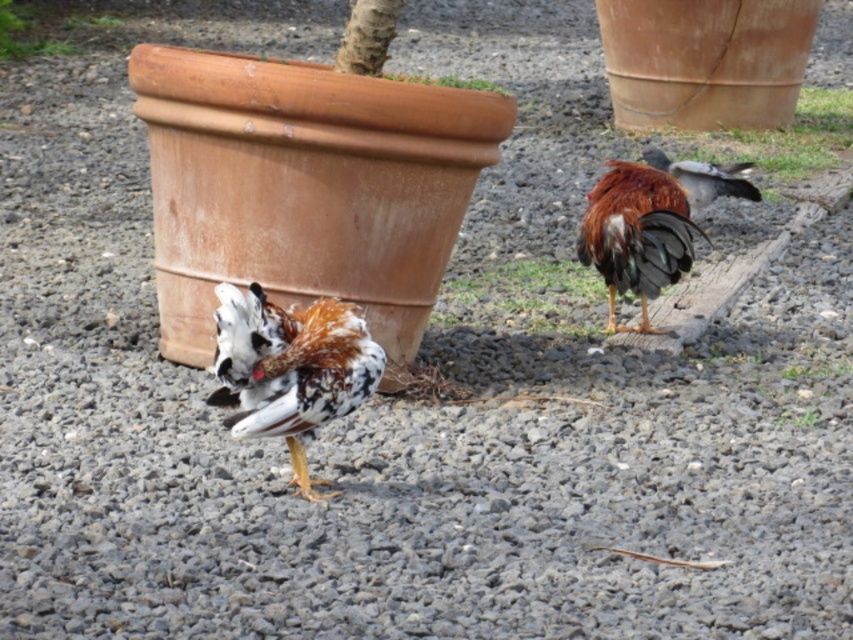
Question: Which of the following is the farthest from the observer?

Choices:
 (A) (630, 196)
 (B) (424, 76)

Answer: (B)

Question: Based on their relative distances, which object is farther from the green leafy plant at upper center?

Choices:
 (A) matte terracotta pot at upper left
 (B) matte brown pot at upper right

Answer: (A)

Question: Can you confirm if speckled feathered chicken at center is smaller than matte brown pot at upper right?

Choices:
 (A) yes
 (B) no

Answer: (A)

Question: Which of these objects is positioned farthest from the speckled feathered chicken at center?

Choices:
 (A) brown matte rooster at center
 (B) green leafy plant at lower center

Answer: (A)

Question: Does speckled feathered chicken at center have a smaller size compared to matte brown pot at upper right?

Choices:
 (A) yes
 (B) no

Answer: (A)

Question: Can you confirm if speckled feathered chicken at center is bigger than green leafy plant at lower center?

Choices:
 (A) no
 (B) yes

Answer: (B)